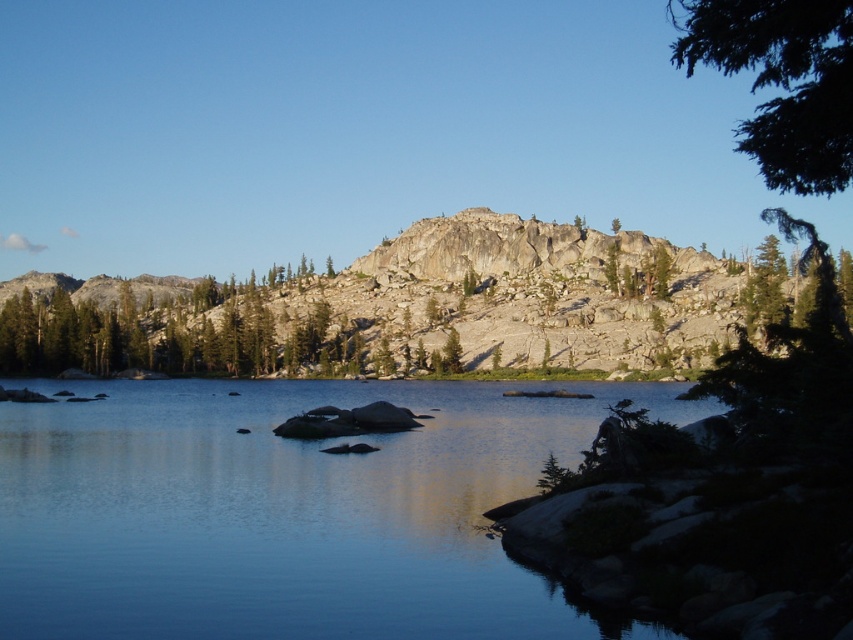
Question: Can you confirm if clear water at center is smaller than granite rock formation at center?

Choices:
 (A) no
 (B) yes

Answer: (B)

Question: Which object appears closest to the camera in this image?

Choices:
 (A) clear water at center
 (B) granite rock formation at center
 (C) green textured tree at center
 (D) green leafy tree at upper right

Answer: (A)

Question: Can you confirm if clear water at center is bigger than green textured tree at center?

Choices:
 (A) no
 (B) yes

Answer: (B)

Question: Among these objects, which one is farthest from the camera?

Choices:
 (A) clear water at center
 (B) granite rock formation at center
 (C) green leafy tree at upper right
 (D) green textured tree at center

Answer: (D)

Question: Among these points, which one is farthest from the camera?

Choices:
 (A) (772, 20)
 (B) (451, 337)

Answer: (B)

Question: Is green leafy tree at upper right smaller than green textured tree at center?

Choices:
 (A) yes
 (B) no

Answer: (B)